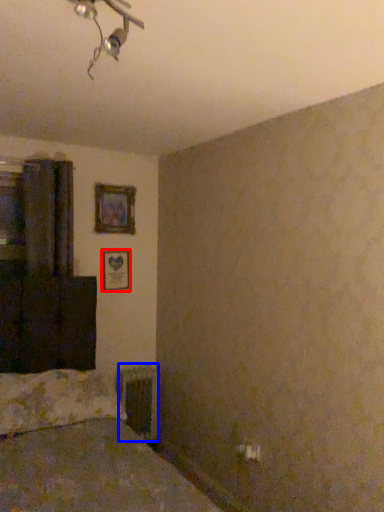
Question: Among these objects, which one is nearest to the camera, picture frame (highlighted by a red box) or radiator (highlighted by a blue box)?

Choices:
 (A) picture frame
 (B) radiator

Answer: (B)